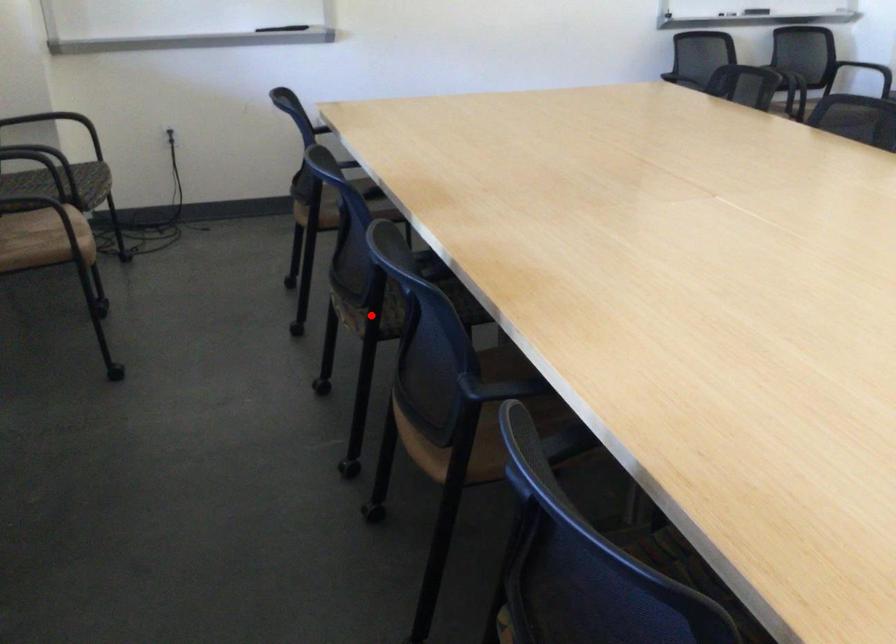
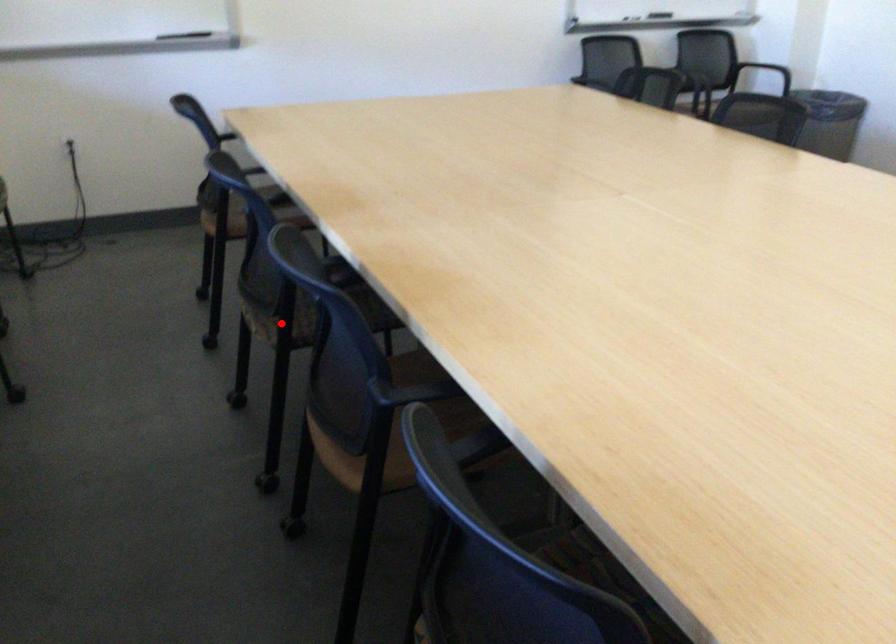
I am providing you with two images of the same scene from different viewpoints. A red point is marked on the first image and another point is marked on the second image. Are the points marked in image1 and image2 representing the same 3D position?

Yes